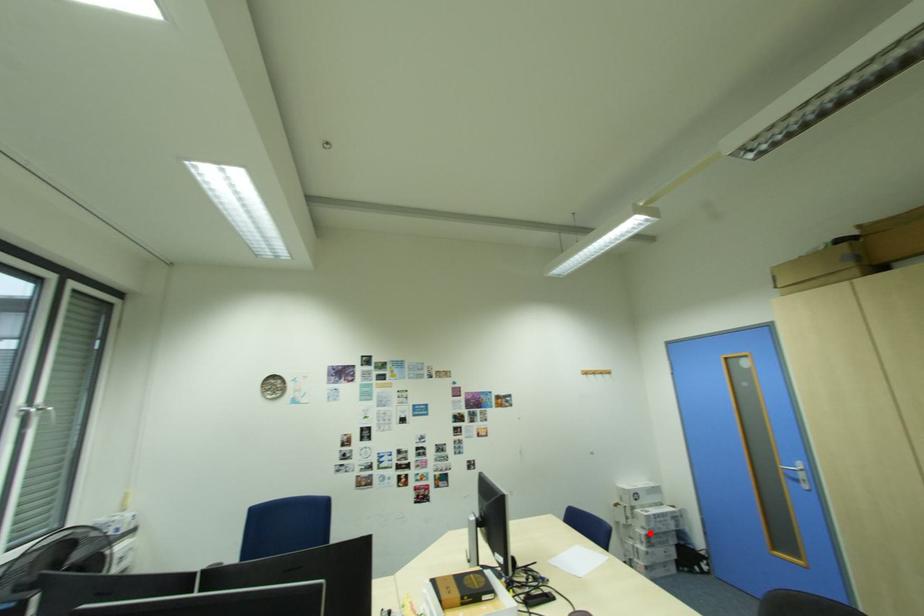
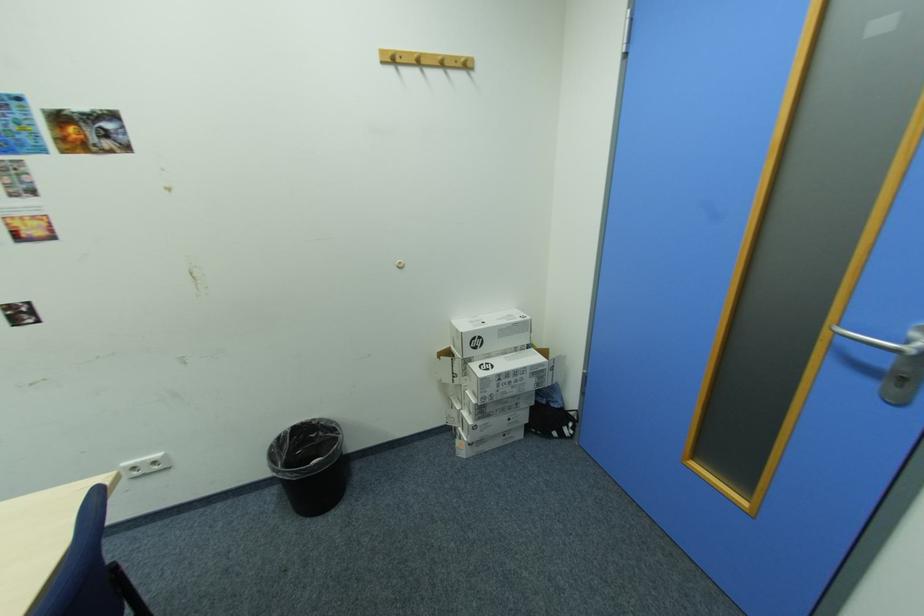
Find the pixel in the second image that matches the highlighted location in the first image.

(481, 400)